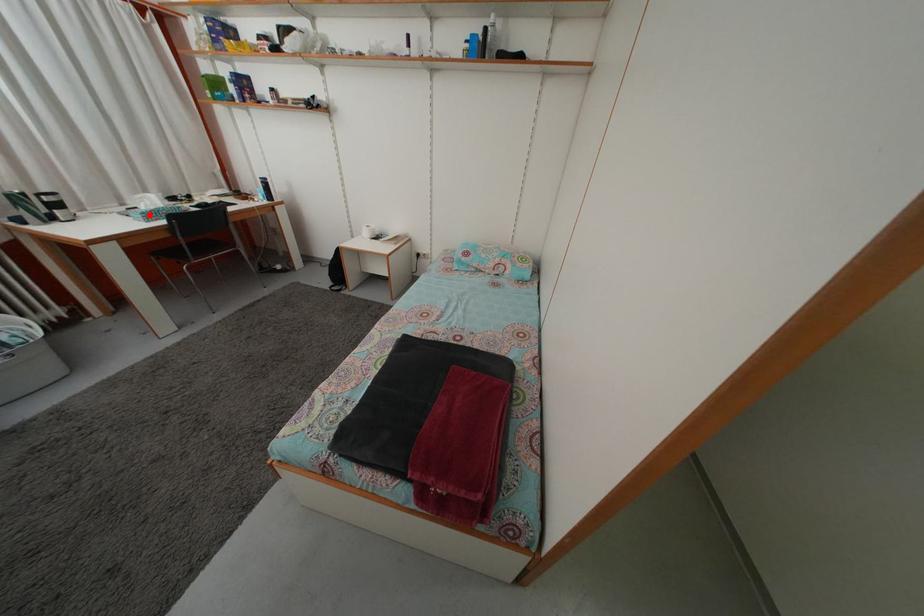
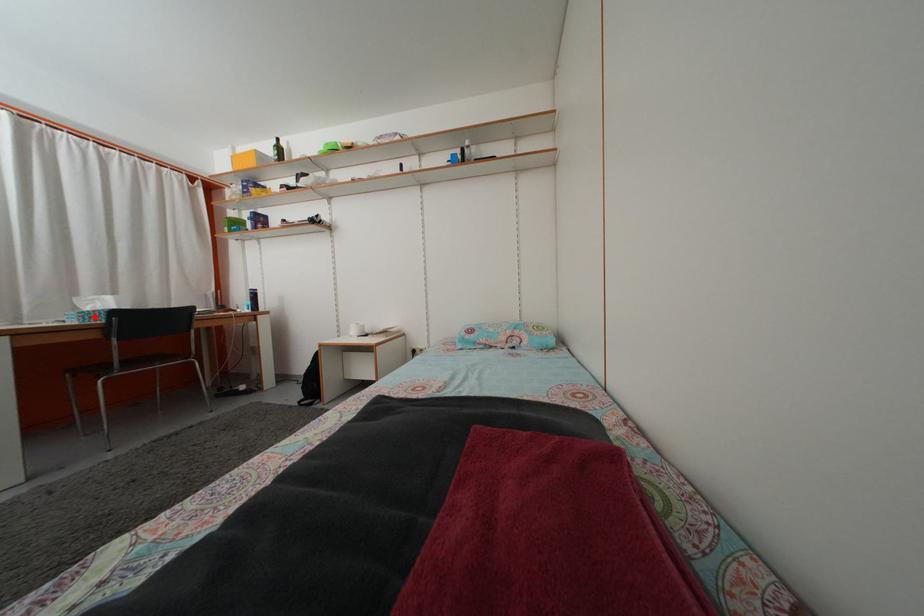
I am providing you with two images of the same scene from different viewpoints. A red point is marked on the first image and another point is marked on the second image. Does the point marked in image1 correspond to the same location as the one in image2?

Yes